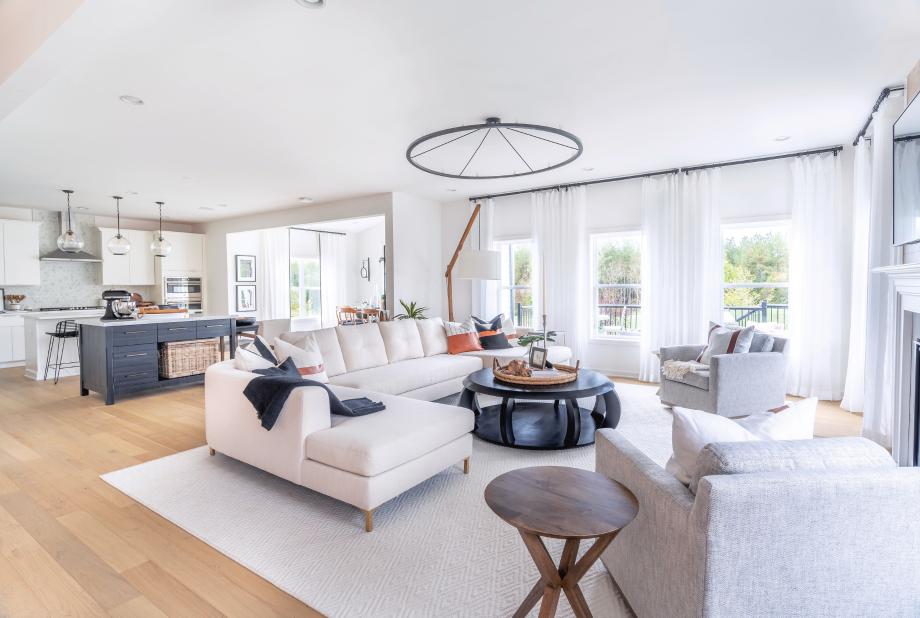
Where is `coffee table`? Image resolution: width=920 pixels, height=618 pixels. coffee table is located at coordinates (546, 394).